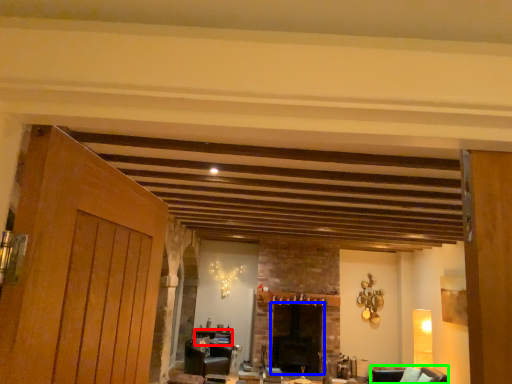
Question: Considering the real-world distances, which object is closest to table (highlighted by a red box)? fireplace (highlighted by a blue box) or armchair (highlighted by a green box).

Choices:
 (A) fireplace
 (B) armchair

Answer: (A)